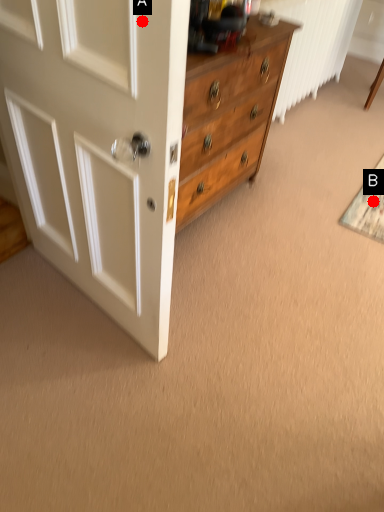
Question: Two points are circled on the image, labeled by A and B beside each circle. Which point appears farthest from the camera in this image?

Choices:
 (A) A is further
 (B) B is further

Answer: (B)